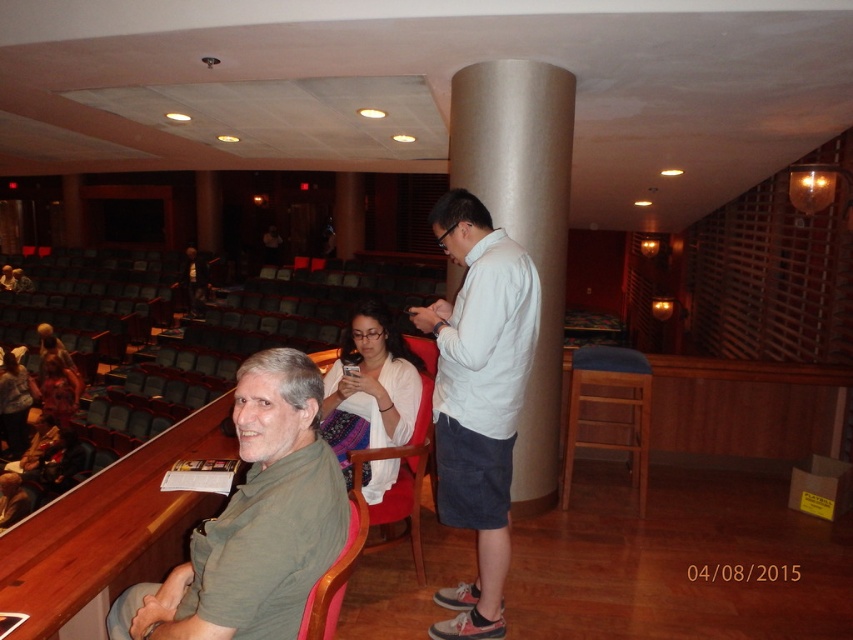
You are an event planner setting up for a presentation. You need to place a large screen between the satin silver column at center and the wooden chair at lower left. Given that the column is larger than the chair, where should the screen be placed to ensure it doesn

The satin silver column at center is larger than the wooden chair at lower left. To place the screen between them appropriately, position it closer to the wooden chair at lower left since the column occupies more space.

You are a stagehand in a theater who needs to move a 6 meter long ladder from the red fabric chair at center to the matte white sweater at lower left. Can you move the ladder without bending it?

The distance between the red fabric chair at center and the matte white sweater at lower left is 5.85 meters. Since the ladder is 6 meters long, it is slightly longer than the available space, so you cannot move it without bending it.